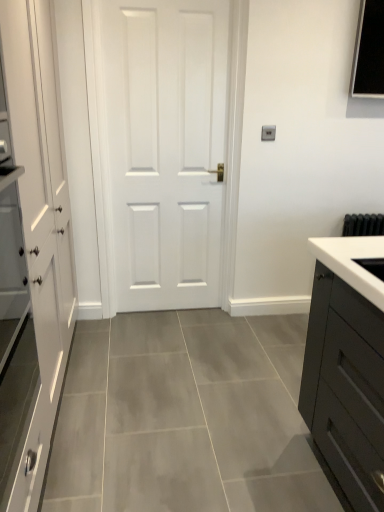
Question: Is white matte cabinet at left shorter than white glossy sink at right?

Choices:
 (A) no
 (B) yes

Answer: (A)

Question: Would you consider white matte cabinet at left to be distant from white glossy sink at right?

Choices:
 (A) yes
 (B) no

Answer: (A)

Question: Does white matte cabinet at left have a greater height compared to white glossy sink at right?

Choices:
 (A) no
 (B) yes

Answer: (B)

Question: From the image's perspective, would you say white matte cabinet at left is shown under white glossy sink at right?

Choices:
 (A) yes
 (B) no

Answer: (B)

Question: Is white matte cabinet at left to the left of white glossy sink at right from the viewer's perspective?

Choices:
 (A) no
 (B) yes

Answer: (B)

Question: Is white matte cabinet at left positioned with its back to white glossy sink at right?

Choices:
 (A) no
 (B) yes

Answer: (A)

Question: Can you confirm if white matte cabinet at left is thinner than white matte door at center?

Choices:
 (A) no
 (B) yes

Answer: (A)

Question: Would you say white matte door at center is part of white matte cabinet at left's contents?

Choices:
 (A) no
 (B) yes

Answer: (A)

Question: Is white matte cabinet at left to the left of white matte door at center from the viewer's perspective?

Choices:
 (A) no
 (B) yes

Answer: (B)

Question: Would you say white matte cabinet at left is a long distance from white matte door at center?

Choices:
 (A) yes
 (B) no

Answer: (B)

Question: Is white matte cabinet at left aimed at white matte door at center?

Choices:
 (A) yes
 (B) no

Answer: (A)

Question: From the image's perspective, is white matte cabinet at left above white matte door at center?

Choices:
 (A) no
 (B) yes

Answer: (A)

Question: Is white matte door at center positioned with its back to white matte cabinet at left?

Choices:
 (A) no
 (B) yes

Answer: (A)